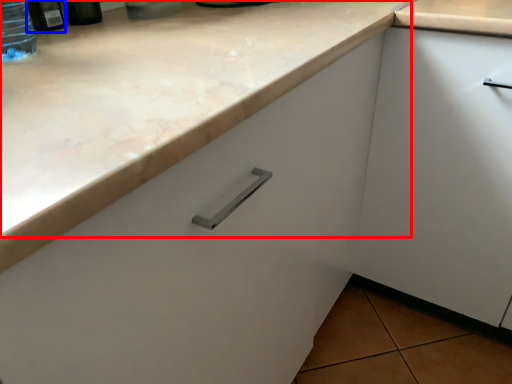
Question: Which of the following is the farthest to the observer, counter top (highlighted by a red box) or bottle (highlighted by a blue box)?

Choices:
 (A) counter top
 (B) bottle

Answer: (B)